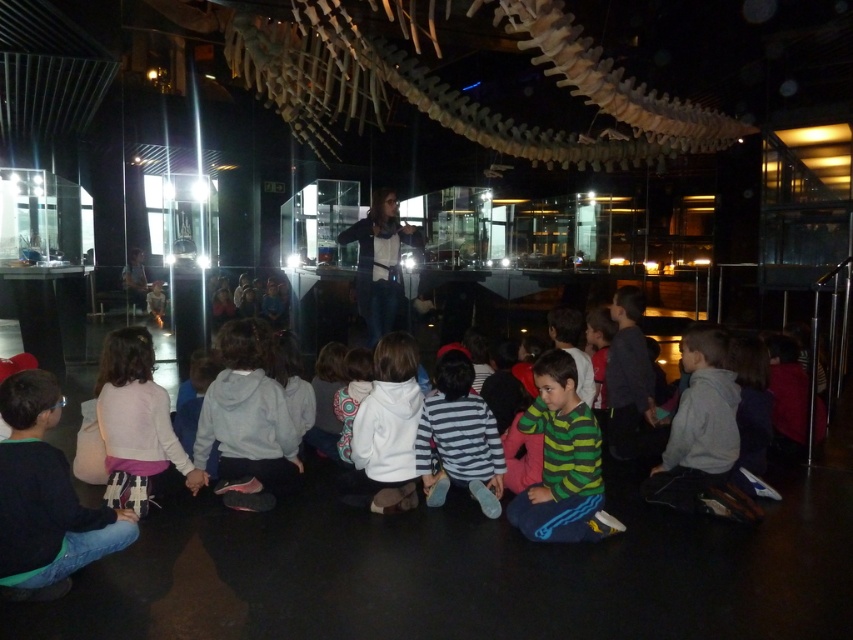
Is gray hoodie at lower right smaller than white fleece jacket at center?

Actually, gray hoodie at lower right might be larger than white fleece jacket at center.

Identify the location of gray hoodie at lower right. (699, 428).

Who is taller, striped jersey at center or gray hoodie at lower right?

With more height is gray hoodie at lower right.

Does striped jersey at center appear on the left side of gray hoodie at lower right?

Correct, you'll find striped jersey at center to the left of gray hoodie at lower right.

Between point (555, 388) and point (708, 492), which one is positioned in front?

Point (555, 388)

Find the location of a particular element. striped jersey at center is located at coordinates (561, 460).

Which is in front, point (599, 488) or point (373, 483)?

Point (599, 488) is in front.

Between striped jersey at center and white fleece jacket at center, which one appears on the left side from the viewer's perspective?

Positioned to the left is white fleece jacket at center.

Who is more distant from viewer, (550, 502) or (402, 461)?

The point (402, 461) is behind.

Where is `striped jersey at center`? striped jersey at center is located at coordinates (561, 460).